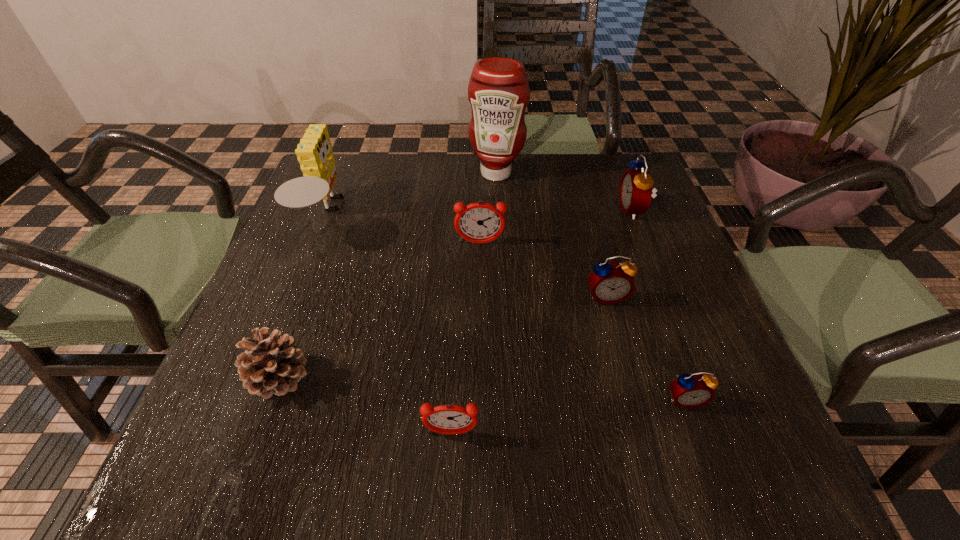
Where is `free region located on the front-facing side of the farther reddish-pink alarm clock`? The image size is (960, 540). free region located on the front-facing side of the farther reddish-pink alarm clock is located at coordinates pos(480,331).

Where is `vacant region located on the front-facing side of the third farthest alarm clock`? The height and width of the screenshot is (540, 960). vacant region located on the front-facing side of the third farthest alarm clock is located at coordinates (641, 428).

In order to click on vacant space located on the back of the brown pinecone in this screenshot , I will do `click(313, 285)`.

The width and height of the screenshot is (960, 540). I want to click on vacant space situated on the front-facing side of the smaller reddish-pink alarm clock, so click(449, 478).

Identify the location of free space located 0.120m on the front-facing side of the smallest red alarm clock. The image size is (960, 540). (714, 484).

This screenshot has height=540, width=960. Find the location of `condiment present at the far edge`. condiment present at the far edge is located at coordinates (498, 91).

Locate an element on the screen. This screenshot has width=960, height=540. sponge located in the far edge section of the desktop is located at coordinates (314, 152).

The width and height of the screenshot is (960, 540). In order to click on alarm clock that is at the far edge in this screenshot , I will do tap(636, 186).

The width and height of the screenshot is (960, 540). What are the coordinates of `object at the near edge` in the screenshot? It's located at (449, 419).

Where is `sponge situated at the left edge`? sponge situated at the left edge is located at coordinates pos(314,152).